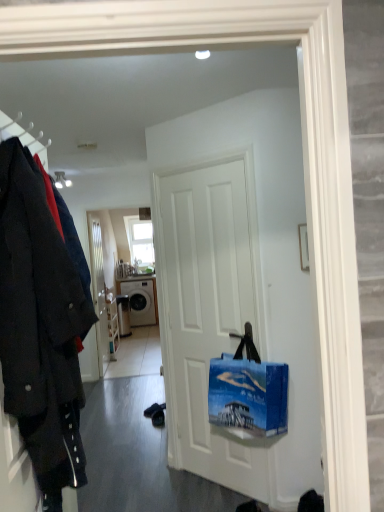
Question: Does white matte door at center, placed as the second door when sorted from back to front, have a lesser height compared to white glossy door at center, which ranks as the first door in back-to-front order?

Choices:
 (A) no
 (B) yes

Answer: (B)

Question: Is white glossy door at center, the first door from the left, inside white matte door at center, the first door positioned from the right?

Choices:
 (A) no
 (B) yes

Answer: (A)

Question: From a real-world perspective, is white matte door at center, the second door when ordered from left to right, below white glossy door at center, which ranks as the first door in back-to-front order?

Choices:
 (A) no
 (B) yes

Answer: (B)

Question: From a real-world perspective, is white matte door at center, the first door positioned from the right, on white glossy door at center, which is the 2th door from front to back?

Choices:
 (A) yes
 (B) no

Answer: (B)

Question: Is white matte door at center, the first door positioned from the right, with white glossy door at center, which ranks as the 2th door in right-to-left order?

Choices:
 (A) yes
 (B) no

Answer: (B)

Question: Are white matte door at center, the second door when ordered from left to right, and white glossy door at center, which is the 2th door from front to back, far apart?

Choices:
 (A) no
 (B) yes

Answer: (B)

Question: Is matte white ceiling light at upper center thinner than white glossy door at center, which ranks as the first door in back-to-front order?

Choices:
 (A) no
 (B) yes

Answer: (A)

Question: Is matte white ceiling light at upper center further to the viewer compared to white glossy door at center, the first door from the left?

Choices:
 (A) no
 (B) yes

Answer: (A)

Question: Is matte white ceiling light at upper center at the left side of white glossy door at center, which ranks as the first door in back-to-front order?

Choices:
 (A) yes
 (B) no

Answer: (A)

Question: Is matte white ceiling light at upper center aimed at white glossy door at center, which ranks as the first door in back-to-front order?

Choices:
 (A) no
 (B) yes

Answer: (A)

Question: From the image's perspective, is matte white ceiling light at upper center on top of white glossy door at center, which is the 2th door from front to back?

Choices:
 (A) no
 (B) yes

Answer: (B)

Question: Is matte white ceiling light at upper center oriented away from white glossy door at center, which ranks as the 2th door in right-to-left order?

Choices:
 (A) no
 (B) yes

Answer: (A)

Question: From a real-world perspective, is dark wool coat at left located beneath white glossy washing machine at center?

Choices:
 (A) yes
 (B) no

Answer: (B)